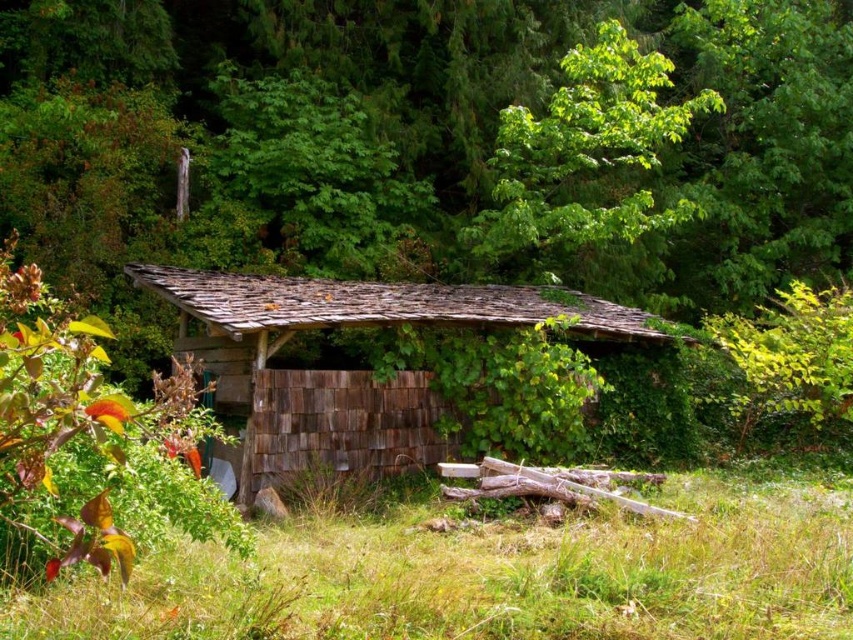
Can you confirm if green grass at lower center is positioned to the right of weathered wood hut at center?

In fact, green grass at lower center is to the left of weathered wood hut at center.

Between green grass at lower center and weathered wood hut at center, which one has more height?

With more height is weathered wood hut at center.

Which is behind, point (358, 572) or point (277, 310)?

The point (277, 310) is more distant.

This screenshot has width=853, height=640. What are the coordinates of `green grass at lower center` in the screenshot? It's located at (494, 577).

Between weathered wood hut at center and green leafy tree at upper center, which one appears on the right side from the viewer's perspective?

Positioned to the right is green leafy tree at upper center.

Does weathered wood hut at center have a larger size compared to green leafy tree at upper center?

No.

The width and height of the screenshot is (853, 640). Describe the element at coordinates (349, 369) in the screenshot. I see `weathered wood hut at center` at that location.

Locate an element on the screen. weathered wood hut at center is located at coordinates (349, 369).

Which is more to the right, green grass at lower center or green leafy tree at upper center?

green leafy tree at upper center

Which is behind, point (338, 548) or point (503, 147)?

The point (503, 147) is more distant.

Locate an element on the screen. The width and height of the screenshot is (853, 640). green grass at lower center is located at coordinates (494, 577).